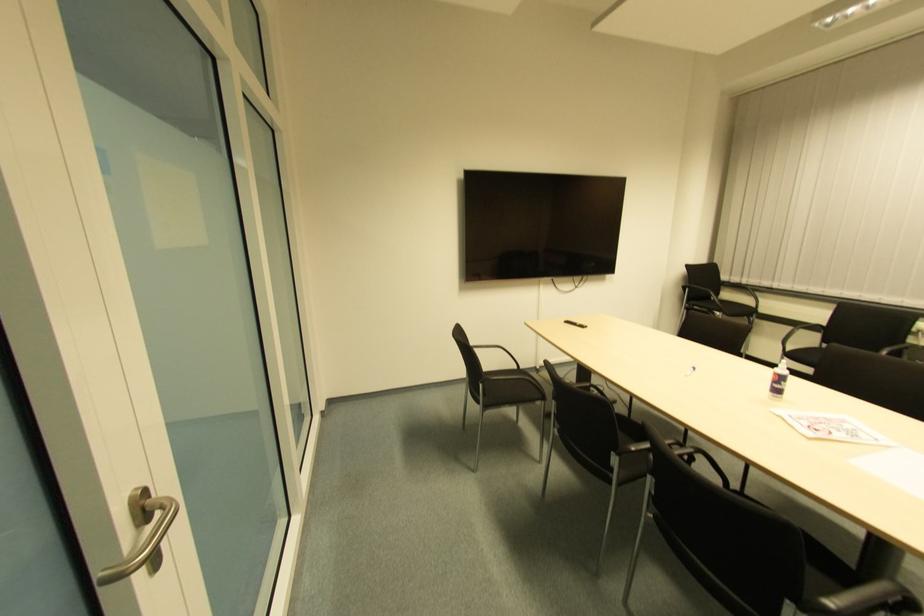
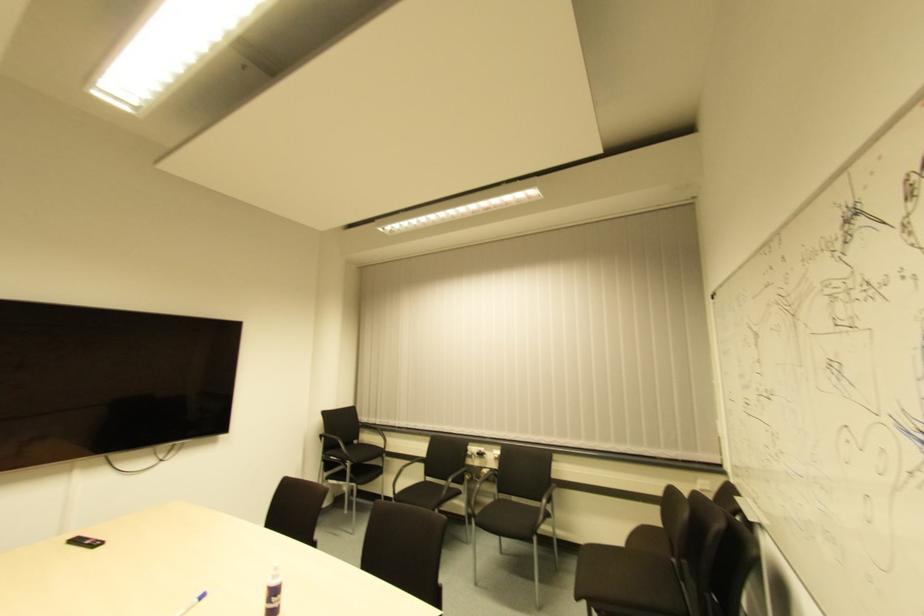
Find the pixel in the second image that matches (x=786, y=352) in the first image.

(395, 495)